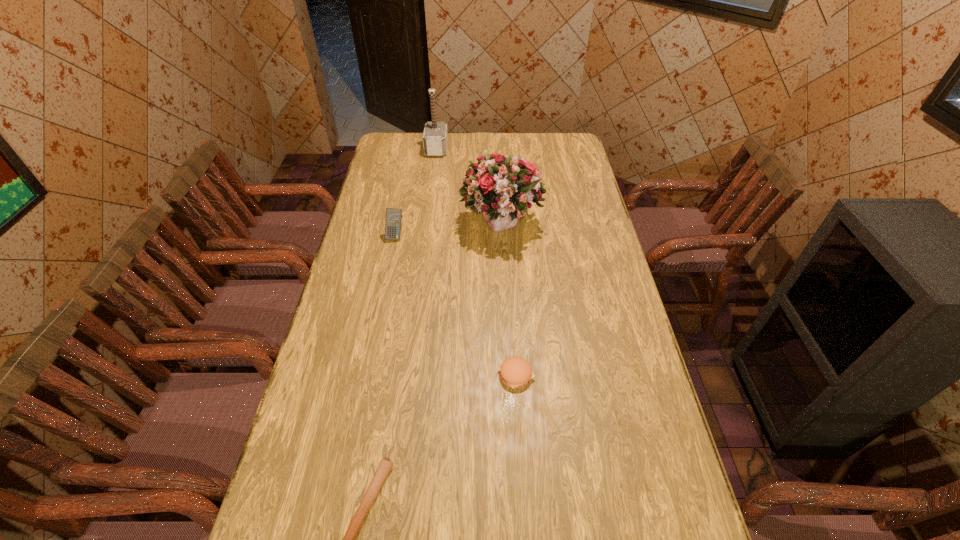
In order to click on the taller hammer in this screenshot , I will do `click(435, 137)`.

Where is `the farther hammer`? This screenshot has height=540, width=960. the farther hammer is located at coordinates (435, 137).

Where is `bouquet`? Image resolution: width=960 pixels, height=540 pixels. bouquet is located at coordinates (503, 188).

I want to click on calculator, so click(393, 219).

This screenshot has width=960, height=540. Find the location of `the fourth farthest object`. the fourth farthest object is located at coordinates pos(515,372).

The width and height of the screenshot is (960, 540). Identify the location of patty. (515, 372).

Locate an element on the screen. Image resolution: width=960 pixels, height=540 pixels. vacant area situated for striking with the head of the farther hammer is located at coordinates (505, 149).

Identify the location of vacant space located on the front of the bouquet. This screenshot has width=960, height=540. pos(503,271).

In order to click on vacant space located 0.350m on the front-facing side of the calculator in this screenshot , I will do tap(379, 317).

Identify the location of blank space located on the right of the second nearest object. [x=621, y=375].